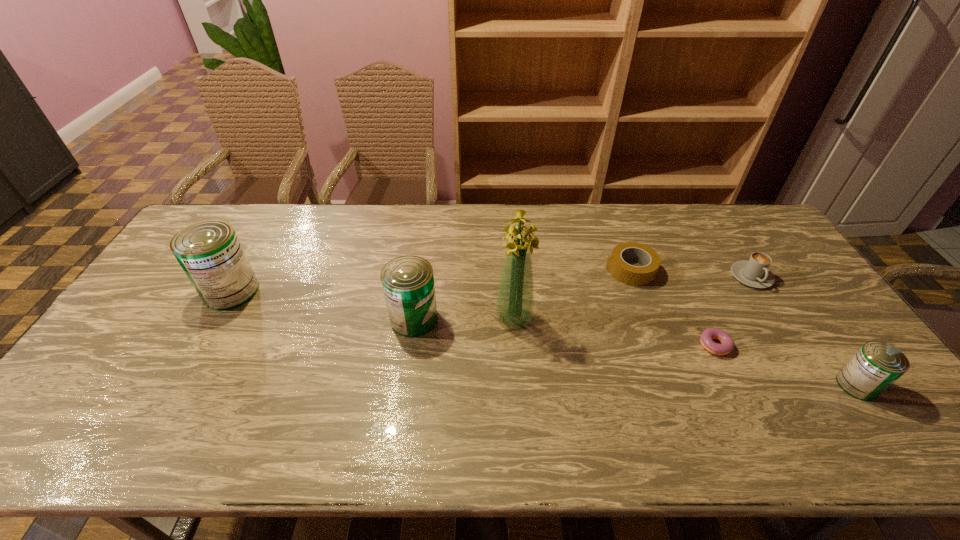
Locate which object is the second closest to the third shortest object. Please provide its 2D coordinates. Your answer should be formatted as a tuple, i.e. [(x, y)], where the tuple contains the x and y coordinates of a point satisfying the conditions above.

[(628, 274)]

What are the coordinates of `object that is the third closest one to the leftmost object` in the screenshot? It's located at (628, 274).

Point out which can is positioned as the second nearest to the cappuccino. Please provide its 2D coordinates. Your answer should be formatted as a tuple, i.e. [(x, y)], where the tuple contains the x and y coordinates of a point satisfying the conditions above.

[(408, 282)]

At what (x,y) coordinates should I click in order to perform the action: click on the closest can to the rightmost can. Please return your answer as a coordinate pair (x, y). Looking at the image, I should click on (408, 282).

Locate an element on the screen. vacant space that satisfies the following two spatial constraints: 1. on the front side of the doughnut; 2. on the right side of the second can from right to left is located at coordinates (410, 346).

Locate an element on the screen. vacant space that satisfies the following two spatial constraints: 1. at the edge of the fourth object from left to right; 2. on the left side of the nearest can is located at coordinates (671, 385).

Locate an element on the screen. The image size is (960, 540). vacant space that satisfies the following two spatial constraints: 1. on the front-facing side of the nearest object; 2. on the right side of the bouquet is located at coordinates (518, 385).

Locate an element on the screen. Image resolution: width=960 pixels, height=540 pixels. vacant position in the image that satisfies the following two spatial constraints: 1. on the front-facing side of the fifth object from left to right; 2. on the right side of the tallest object is located at coordinates (516, 346).

Identify the location of blank area in the image that satisfies the following two spatial constraints: 1. on the front side of the leftmost can; 2. on the right side of the nearest can. The height and width of the screenshot is (540, 960). (179, 385).

At what (x,y) coordinates should I click in order to perform the action: click on vacant region that satisfies the following two spatial constraints: 1. at the edge of the nearest object; 2. on the right side of the second shortest object. Please return your answer as a coordinate pair (x, y). Looking at the image, I should click on (671, 385).